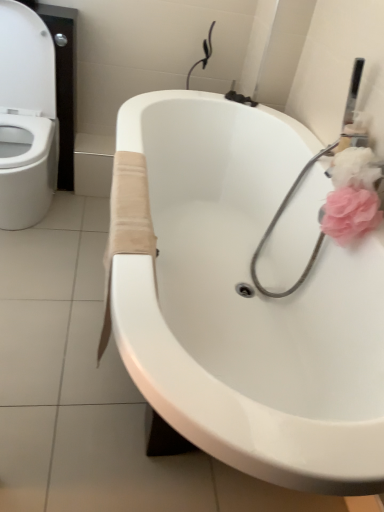
What do you see at coordinates (247, 303) in the screenshot? I see `white glossy bathtub at center` at bounding box center [247, 303].

Describe the element at coordinates (127, 224) in the screenshot. I see `beige fabric towel at lower center` at that location.

Locate an element on the screen. The image size is (384, 512). pink fluffy flower at upper right, acting as the second flower starting from the bottom is located at coordinates (354, 168).

At what (x,y) coordinates should I click in order to perform the action: click on pink fluffy sponge at upper right, the second flower in the top-to-bottom sequence. Please return your answer as a coordinate pair (x, y). This screenshot has width=384, height=512. Looking at the image, I should click on (350, 214).

Can you confirm if pink fluffy flower at upper right, which is the 1th flower in top-to-bottom order, is shorter than white glossy toilet at left?

Yes, pink fluffy flower at upper right, which is the 1th flower in top-to-bottom order, is shorter than white glossy toilet at left.

Based on the photo, which object is positioned more to the right, pink fluffy flower at upper right, acting as the second flower starting from the bottom, or white glossy toilet at left?

Positioned to the right is pink fluffy flower at upper right, acting as the second flower starting from the bottom.

From a real-world perspective, which is physically above, pink fluffy flower at upper right, acting as the second flower starting from the bottom, or white glossy toilet at left?

pink fluffy flower at upper right, acting as the second flower starting from the bottom.

Do you think pink fluffy sponge at upper right, the second flower in the top-to-bottom sequence, is within white glossy bathtub at center, or outside of it?

pink fluffy sponge at upper right, the second flower in the top-to-bottom sequence, is contained in white glossy bathtub at center.

Which of these two, pink fluffy sponge at upper right, the second flower in the top-to-bottom sequence, or white glossy bathtub at center, is thinner?

With smaller width is pink fluffy sponge at upper right, the second flower in the top-to-bottom sequence.

Does pink fluffy sponge at upper right, acting as the first flower starting from the bottom, appear on the left side of white glossy bathtub at center?

In fact, pink fluffy sponge at upper right, acting as the first flower starting from the bottom, is to the right of white glossy bathtub at center.

Is white glossy toilet at left surrounding pink fluffy sponge at upper right, acting as the first flower starting from the bottom?

No.

Which object is positioned more to the left, white glossy toilet at left or pink fluffy sponge at upper right, the second flower in the top-to-bottom sequence?

white glossy toilet at left is more to the left.

Based on their sizes in the image, would you say white glossy toilet at left is bigger or smaller than pink fluffy sponge at upper right, acting as the first flower starting from the bottom?

white glossy toilet at left is bigger than pink fluffy sponge at upper right, acting as the first flower starting from the bottom.

Which of these two, pink fluffy flower at upper right, which is the 1th flower in top-to-bottom order, or pink fluffy sponge at upper right, the second flower in the top-to-bottom sequence, is wider?

pink fluffy flower at upper right, which is the 1th flower in top-to-bottom order, is wider.

Is pink fluffy flower at upper right, which is the 1th flower in top-to-bottom order, taller or shorter than pink fluffy sponge at upper right, the second flower in the top-to-bottom sequence?

Considering their sizes, pink fluffy flower at upper right, which is the 1th flower in top-to-bottom order, has less height than pink fluffy sponge at upper right, the second flower in the top-to-bottom sequence.

From the image's perspective, which one is positioned higher, pink fluffy flower at upper right, which is the 1th flower in top-to-bottom order, or pink fluffy sponge at upper right, acting as the first flower starting from the bottom?

pink fluffy flower at upper right, which is the 1th flower in top-to-bottom order, appears higher in the image.

Would you say pink fluffy flower at upper right, which is the 1th flower in top-to-bottom order, is outside pink fluffy sponge at upper right, acting as the first flower starting from the bottom?

Absolutely, pink fluffy flower at upper right, which is the 1th flower in top-to-bottom order, is external to pink fluffy sponge at upper right, acting as the first flower starting from the bottom.

Consider the image. Can you confirm if pink fluffy flower at upper right, acting as the second flower starting from the bottom, is thinner than white glossy bathtub at center?

Correct, the width of pink fluffy flower at upper right, acting as the second flower starting from the bottom, is less than that of white glossy bathtub at center.

Is the position of pink fluffy flower at upper right, acting as the second flower starting from the bottom, more distant than that of white glossy bathtub at center?

Yes, the depth of pink fluffy flower at upper right, acting as the second flower starting from the bottom, is greater than that of white glossy bathtub at center.

Would you say white glossy bathtub at center is part of pink fluffy flower at upper right, acting as the second flower starting from the bottom,'s contents?

No, white glossy bathtub at center is not inside pink fluffy flower at upper right, acting as the second flower starting from the bottom.

Is the depth of beige fabric towel at lower center greater than that of pink fluffy flower at upper right, which is the 1th flower in top-to-bottom order?

No, beige fabric towel at lower center is closer to the camera.

Which object is thinner, beige fabric towel at lower center or pink fluffy flower at upper right, acting as the second flower starting from the bottom?

pink fluffy flower at upper right, acting as the second flower starting from the bottom, is thinner.

Does beige fabric towel at lower center touch pink fluffy flower at upper right, acting as the second flower starting from the bottom?

beige fabric towel at lower center and pink fluffy flower at upper right, acting as the second flower starting from the bottom, are clearly separated.

Between beige fabric towel at lower center and pink fluffy sponge at upper right, acting as the first flower starting from the bottom, which one appears on the right side from the viewer's perspective?

Positioned to the right is pink fluffy sponge at upper right, acting as the first flower starting from the bottom.

From the image's perspective, which one is positioned lower, beige fabric towel at lower center or pink fluffy sponge at upper right, the second flower in the top-to-bottom sequence?

beige fabric towel at lower center is shown below in the image.

Is the depth of beige fabric towel at lower center greater than that of pink fluffy sponge at upper right, the second flower in the top-to-bottom sequence?

No, it is in front of pink fluffy sponge at upper right, the second flower in the top-to-bottom sequence.

Which is behind, point (116, 217) or point (364, 205)?

Positioned behind is point (364, 205).

Locate an element on the screen. the 2nd flower counting from the right of the white glossy toilet at left is located at coordinates (354, 168).

Locate an element on the screen. This screenshot has width=384, height=512. the 1st flower behind the white glossy bathtub at center is located at coordinates (350, 214).

Considering their positions, is white glossy bathtub at center positioned closer to beige fabric towel at lower center than pink fluffy flower at upper right, which is the 1th flower in top-to-bottom order?

white glossy bathtub at center lies closer to beige fabric towel at lower center than the other object.

Estimate the real-world distances between objects in this image. Which object is further from beige fabric towel at lower center, pink fluffy sponge at upper right, acting as the first flower starting from the bottom, or pink fluffy flower at upper right, which is the 1th flower in top-to-bottom order?

pink fluffy flower at upper right, which is the 1th flower in top-to-bottom order, is further to beige fabric towel at lower center.

Which object lies further to the anchor point white glossy toilet at left, pink fluffy flower at upper right, which is the 1th flower in top-to-bottom order, or beige fabric towel at lower center?

pink fluffy flower at upper right, which is the 1th flower in top-to-bottom order, is further to white glossy toilet at left.

Which object lies further to the anchor point pink fluffy sponge at upper right, acting as the first flower starting from the bottom, beige fabric towel at lower center or white glossy bathtub at center?

Among the two, beige fabric towel at lower center is located further to pink fluffy sponge at upper right, acting as the first flower starting from the bottom.

Estimate the real-world distances between objects in this image. Which object is further from beige fabric towel at lower center, pink fluffy flower at upper right, which is the 1th flower in top-to-bottom order, or white glossy bathtub at center?

The object further to beige fabric towel at lower center is pink fluffy flower at upper right, which is the 1th flower in top-to-bottom order.

Looking at the image, which one is located closer to pink fluffy sponge at upper right, the second flower in the top-to-bottom sequence, white glossy bathtub at center or beige fabric towel at lower center?

white glossy bathtub at center is closer to pink fluffy sponge at upper right, the second flower in the top-to-bottom sequence.

When comparing their distances from pink fluffy sponge at upper right, acting as the first flower starting from the bottom, does white glossy bathtub at center or pink fluffy flower at upper right, acting as the second flower starting from the bottom, seem further?

white glossy bathtub at center.

Estimate the real-world distances between objects in this image. Which object is further from beige fabric towel at lower center, pink fluffy sponge at upper right, acting as the first flower starting from the bottom, or white glossy bathtub at center?

The object further to beige fabric towel at lower center is pink fluffy sponge at upper right, acting as the first flower starting from the bottom.

The image size is (384, 512). In order to click on flower between white glossy bathtub at center and pink fluffy flower at upper right, acting as the second flower starting from the bottom, along the z-axis in this screenshot , I will do `click(350, 214)`.

Locate an element on the screen. sink between beige fabric towel at lower center and pink fluffy flower at upper right, acting as the second flower starting from the bottom, from left to right is located at coordinates (247, 303).

Locate an element on the screen. The height and width of the screenshot is (512, 384). sink between white glossy toilet at left and pink fluffy sponge at upper right, acting as the first flower starting from the bottom, from left to right is located at coordinates (247, 303).

Locate an element on the screen. The image size is (384, 512). flower between beige fabric towel at lower center and pink fluffy flower at upper right, acting as the second flower starting from the bottom is located at coordinates (350, 214).